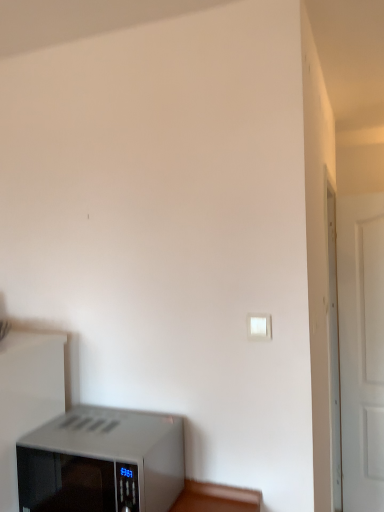
Question: Can you confirm if satin silver microwave at lower left is bigger than white plastic light switch at upper right?

Choices:
 (A) yes
 (B) no

Answer: (A)

Question: Is satin silver microwave at lower left shorter than white plastic light switch at upper right?

Choices:
 (A) no
 (B) yes

Answer: (A)

Question: Does satin silver microwave at lower left have a greater width compared to white plastic light switch at upper right?

Choices:
 (A) no
 (B) yes

Answer: (B)

Question: Could you tell me if satin silver microwave at lower left is facing white plastic light switch at upper right?

Choices:
 (A) no
 (B) yes

Answer: (A)

Question: From a real-world perspective, does satin silver microwave at lower left sit lower than white plastic light switch at upper right?

Choices:
 (A) yes
 (B) no

Answer: (A)

Question: Are satin silver microwave at lower left and white plastic light switch at upper right beside each other?

Choices:
 (A) no
 (B) yes

Answer: (A)

Question: Does white plastic light switch at upper right have a greater height compared to satin silver microwave at lower left?

Choices:
 (A) no
 (B) yes

Answer: (A)

Question: Would you say white plastic light switch at upper right is outside satin silver microwave at lower left?

Choices:
 (A) no
 (B) yes

Answer: (B)

Question: Is the depth of white plastic light switch at upper right greater than that of satin silver microwave at lower left?

Choices:
 (A) yes
 (B) no

Answer: (A)

Question: From the image's perspective, is white plastic light switch at upper right on satin silver microwave at lower left?

Choices:
 (A) yes
 (B) no

Answer: (A)

Question: Is white plastic light switch at upper right closer to the viewer compared to satin silver microwave at lower left?

Choices:
 (A) yes
 (B) no

Answer: (B)

Question: Does white plastic light switch at upper right have a smaller size compared to satin silver microwave at lower left?

Choices:
 (A) yes
 (B) no

Answer: (A)

Question: Is white plastic light switch at upper right to the left of white matte door at right from the viewer's perspective?

Choices:
 (A) no
 (B) yes

Answer: (B)